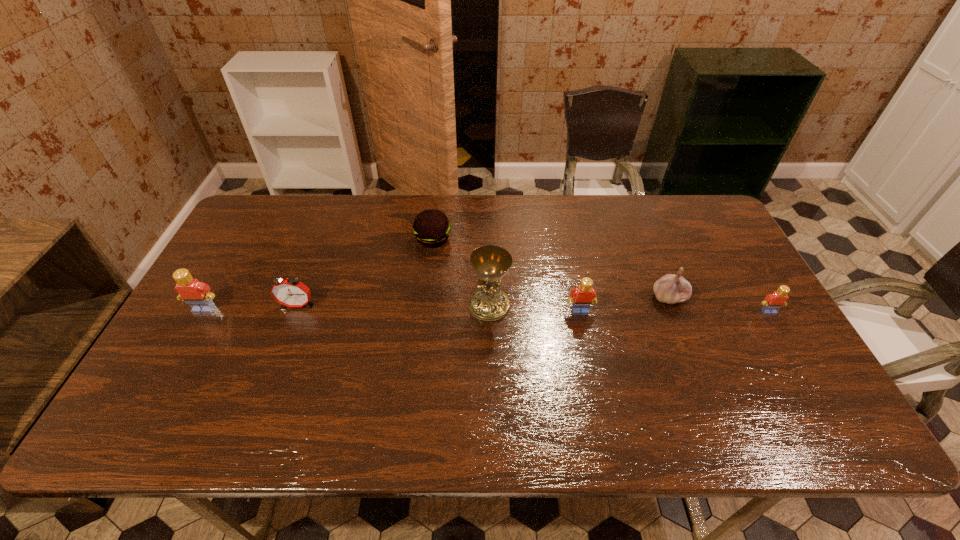
I want to click on object that is at the left edge, so 197,294.

This screenshot has height=540, width=960. I want to click on object at the right edge, so click(x=774, y=301).

Locate an element on the screen. This screenshot has height=540, width=960. free spot at the far edge of the desktop is located at coordinates (403, 214).

Identify the location of free location at the near edge. The height and width of the screenshot is (540, 960). (333, 397).

Locate an element on the screen. Image resolution: width=960 pixels, height=540 pixels. vacant position at the left edge of the desktop is located at coordinates (242, 259).

The image size is (960, 540). What are the coordinates of `free location at the right edge of the desktop` in the screenshot? It's located at (756, 300).

At what (x,y) coordinates should I click in order to perform the action: click on blank area at the far left corner. Please return your answer as a coordinate pair (x, y). This screenshot has height=540, width=960. Looking at the image, I should click on (289, 228).

This screenshot has width=960, height=540. What are the coordinates of `free space between the second object from right to left and the second shortest Lego` in the screenshot? It's located at (625, 304).

In order to click on vacant space in between the fourth object from left to right and the second tallest Lego in this screenshot , I will do `click(535, 308)`.

At what (x,y) coordinates should I click in order to perform the action: click on free space that is in between the second tallest object and the garlic. Please return your answer as a coordinate pair (x, y). The width and height of the screenshot is (960, 540). Looking at the image, I should click on (437, 303).